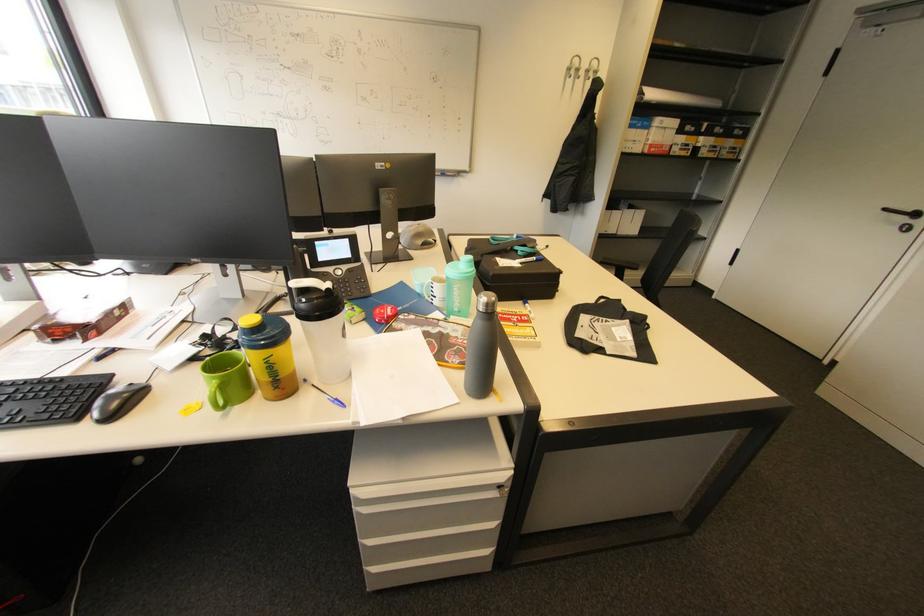
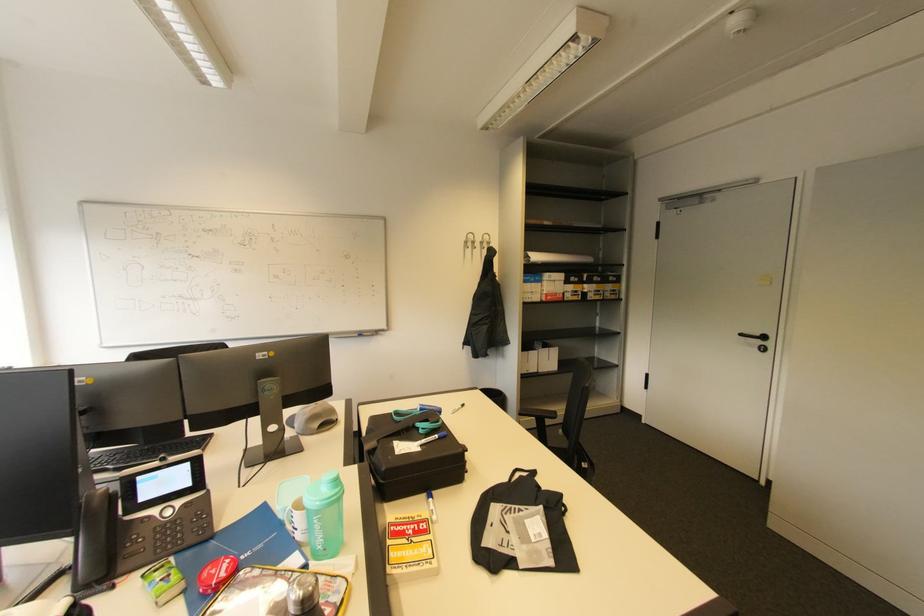
The point at (540, 259) is marked in the first image. Where is the corresponding point in the second image?

(441, 437)